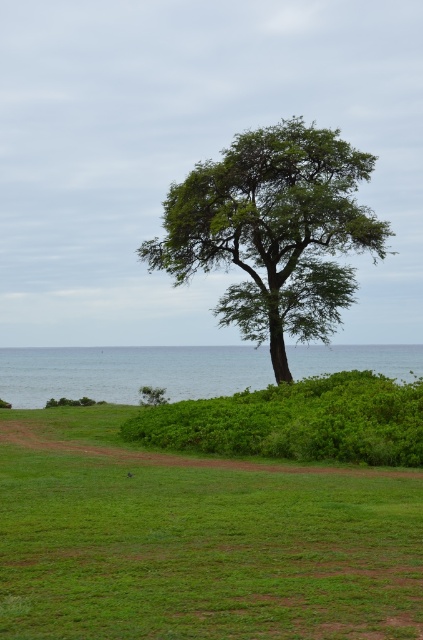
Is point (181, 556) positioned after point (176, 365)?

That is False.

Who is more distant from viewer, (260, 614) or (106, 355)?

The point (106, 355) is more distant.

I want to click on green grassy field at center, so click(x=197, y=541).

In the scene shown: Does green grassy field at center have a greater height compared to green leafy tree at center?

Incorrect, green grassy field at center's height is not larger of green leafy tree at center's.

Which is more to the right, green grassy field at center or green leafy tree at center?

From the viewer's perspective, green leafy tree at center appears more on the right side.

This screenshot has width=423, height=640. What do you see at coordinates (197, 541) in the screenshot?
I see `green grassy field at center` at bounding box center [197, 541].

The width and height of the screenshot is (423, 640). I want to click on green grassy field at center, so point(197,541).

Image resolution: width=423 pixels, height=640 pixels. What do you see at coordinates (274, 230) in the screenshot?
I see `green leafy tree at center` at bounding box center [274, 230].

Which is more to the left, green leafy tree at center or blue water at lower left?

green leafy tree at center

Is point (343, 220) positioned behind point (101, 388)?

No, it is in front of (101, 388).

Where is `green leafy tree at center`? The height and width of the screenshot is (640, 423). green leafy tree at center is located at coordinates (274, 230).